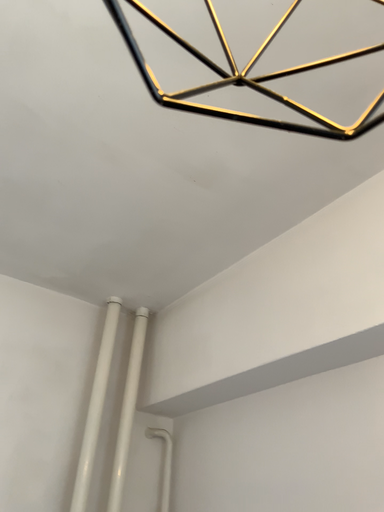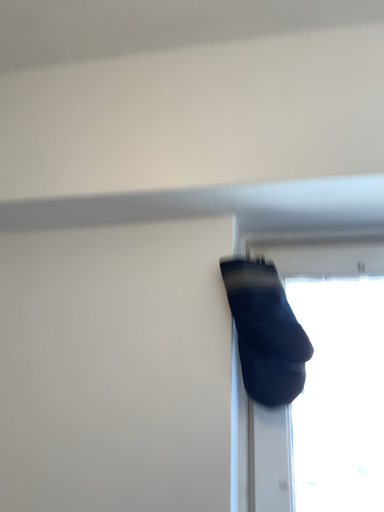
Question: How did the camera likely rotate when shooting the video?

Choices:
 (A) rotated right
 (B) rotated left

Answer: (A)